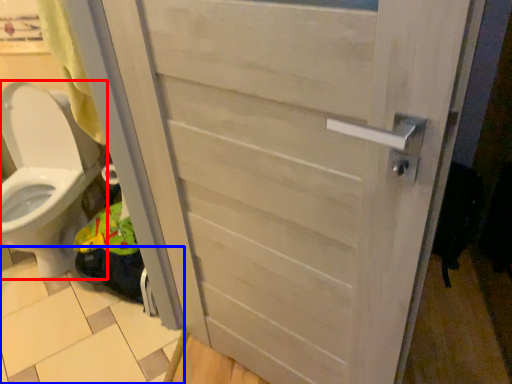
Question: Which of the following is the farthest to the observer, toilet (highlighted by a red box) or tile (highlighted by a blue box)?

Choices:
 (A) toilet
 (B) tile

Answer: (B)